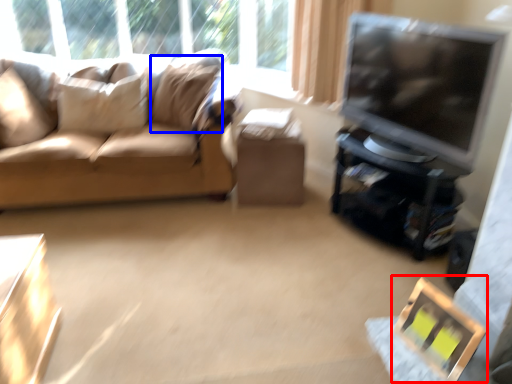
Question: Which point is further to the camera, picture frame (highlighted by a red box) or pillow (highlighted by a blue box)?

Choices:
 (A) picture frame
 (B) pillow

Answer: (B)